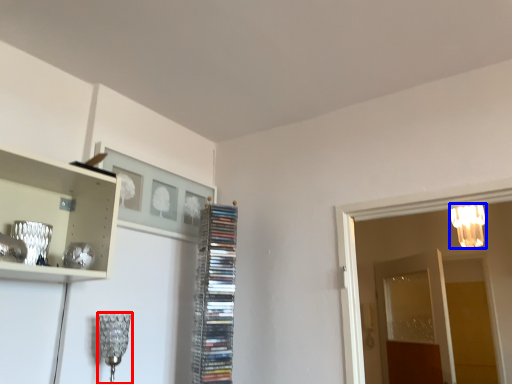
Question: Which object is closer to the camera taking this photo, lamp (highlighted by a red box) or lamp (highlighted by a blue box)?

Choices:
 (A) lamp
 (B) lamp

Answer: (A)